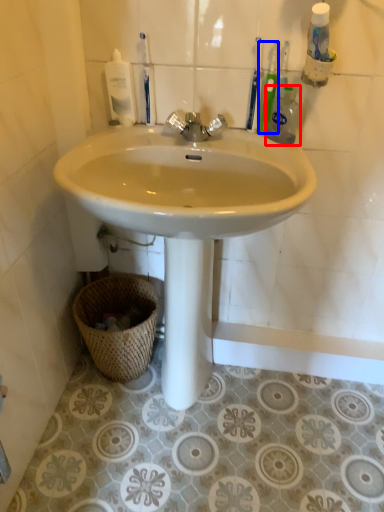
Question: Which object is further to the camera taking this photo, cleaning product (highlighted by a red box) or toothbrush (highlighted by a blue box)?

Choices:
 (A) cleaning product
 (B) toothbrush

Answer: (B)